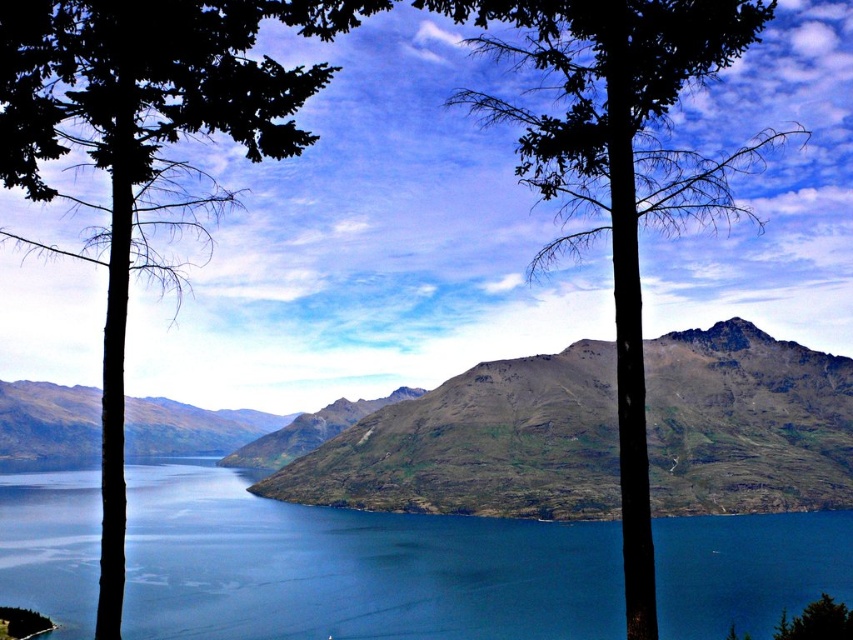
You are standing in front of the serene natural landscape described. You notice the blue water at center and the dark green leafy tree at left. Which object occupies a lower position in the scene?

The blue water at center has a lesser height compared to the dark green leafy tree at left, so the blue water at center is lower in the scene.

You are standing at the edge of the lake and see the blue water at center and the green leafy tree at center. Which object is more to the left?

The blue water at center is more to the left because it is positioned on the left side of the green leafy tree at center.

You are an artist planning to paint this landscape. You want to ensure the blue water at center and the dark green leafy tree at left are both visible in your painting. Considering their sizes in the image, which object should you paint smaller to maintain the scene proportions?

The blue water at center occupies less space than the dark green leafy tree at left, so you should paint the blue water at center smaller to maintain the scene proportions.